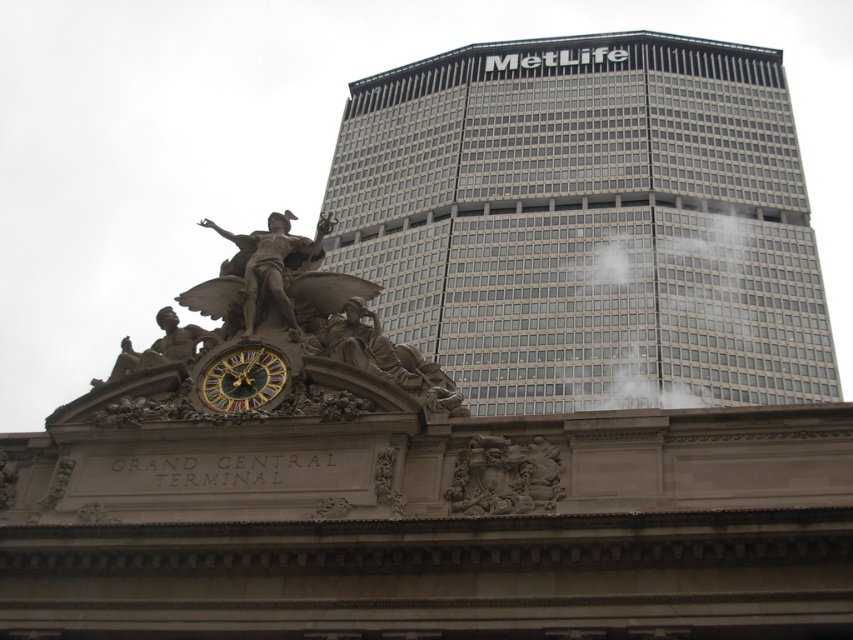
Question: Is gray glass skyscraper at upper right positioned in front of polished bronze statue at center?

Choices:
 (A) yes
 (B) no

Answer: (B)

Question: Can you confirm if white fog at center is thinner than gold-gilded clock face at center?

Choices:
 (A) yes
 (B) no

Answer: (B)

Question: Which of these objects is positioned closest to the gray glass skyscraper at upper right?

Choices:
 (A) gold-gilded clock face at center
 (B) polished bronze statue at center
 (C) carved stone relief at center
 (D) bronze statue at center

Answer: (B)

Question: Can you confirm if white fog at center is wider than bronze statue at center?

Choices:
 (A) no
 (B) yes

Answer: (B)

Question: Which point is farther from the camera taking this photo?

Choices:
 (A) (302, 268)
 (B) (537, 166)
 (C) (485, 452)
 (D) (656, 243)

Answer: (B)

Question: Among these objects, which one is nearest to the camera?

Choices:
 (A) bronze statue at center
 (B) carved stone relief at center

Answer: (B)